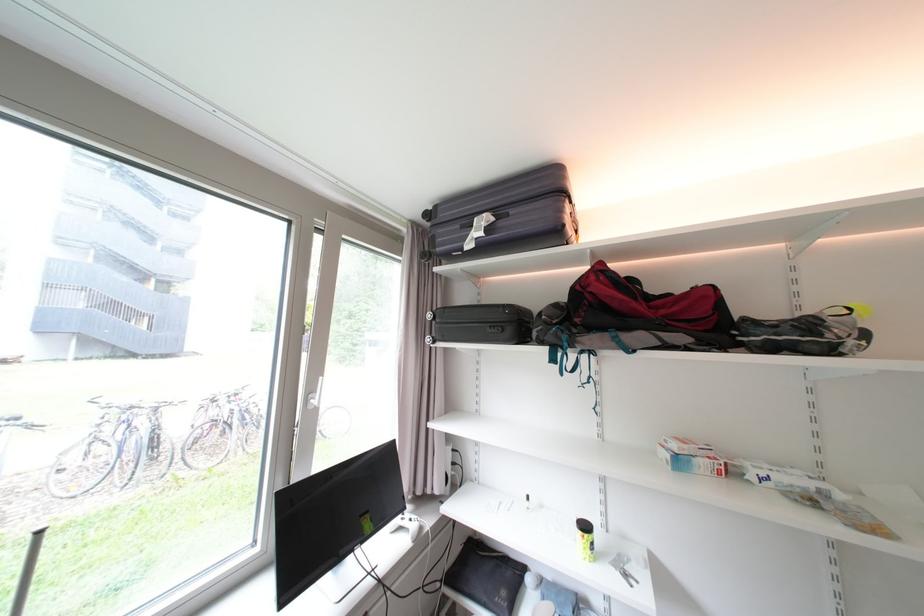
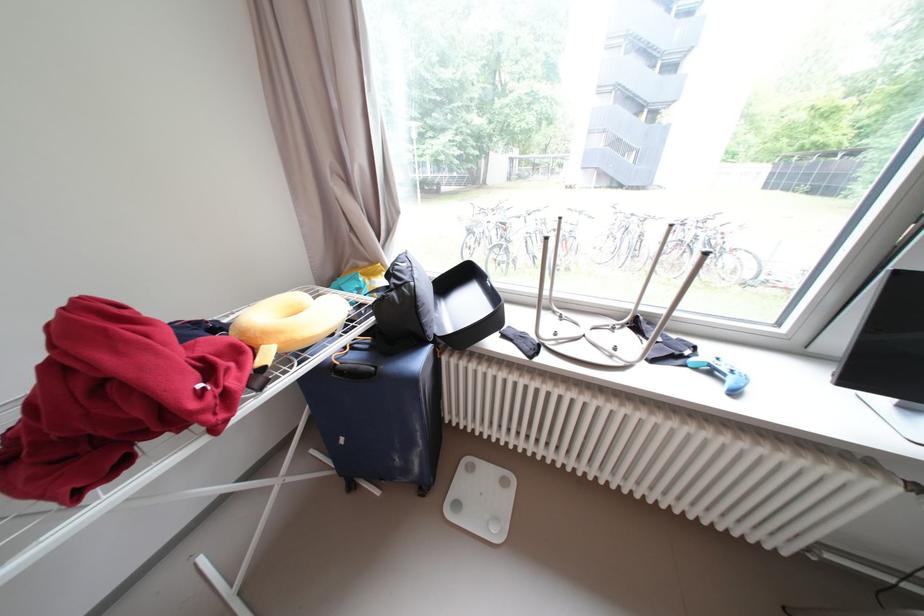
How did the camera likely rotate?

The rotation direction of the camera is left-down.